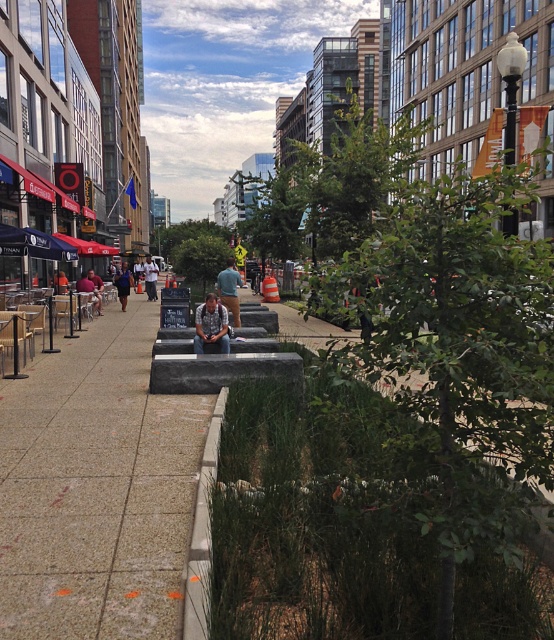
Question: Which of the following is the farthest from the observer?

Choices:
 (A) blue jeans at center
 (B) gray concrete bench at center

Answer: (A)

Question: Is dark blue jeans at center wider than white cotton shirt at center?

Choices:
 (A) no
 (B) yes

Answer: (B)

Question: Which point is closer to the camera?

Choices:
 (A) (94, 300)
 (B) (155, 280)
 (C) (122, 285)

Answer: (A)

Question: Does white cotton shirt at center have a greater width compared to dark blue shirt at center?

Choices:
 (A) no
 (B) yes

Answer: (B)

Question: Is blue jeans at center smaller than dark blue jeans at center?

Choices:
 (A) yes
 (B) no

Answer: (A)

Question: Considering the real-world distances, which object is farthest from the dark blue jeans at center?

Choices:
 (A) white cotton shirt at center
 (B) blue jeans at center
 (C) dark gray concrete bench at center

Answer: (C)